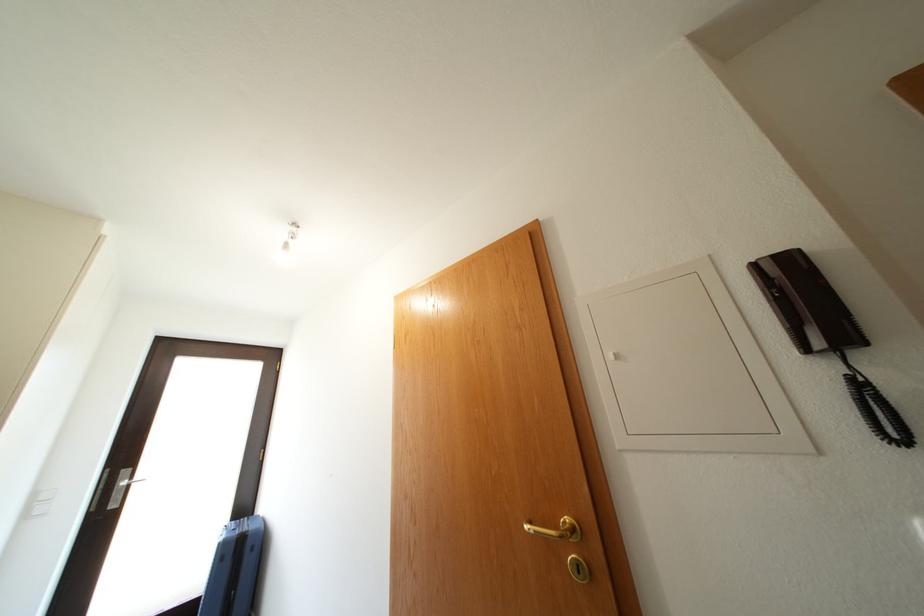
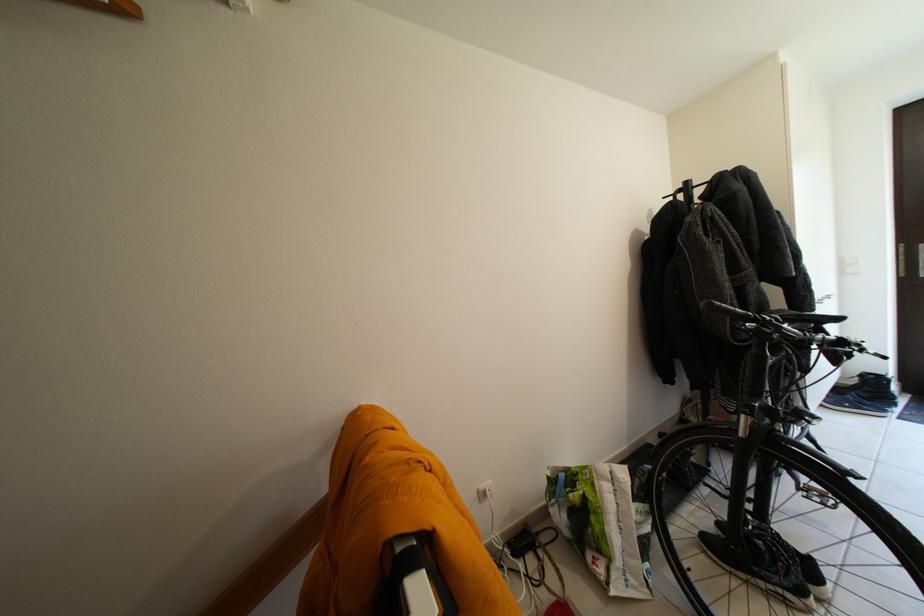
Question: The images are taken continuously from a first-person perspective. In which direction is your viewpoint rotating?

Choices:
 (A) Left
 (B) Right
 (C) Up
 (D) Down

Answer: (A)